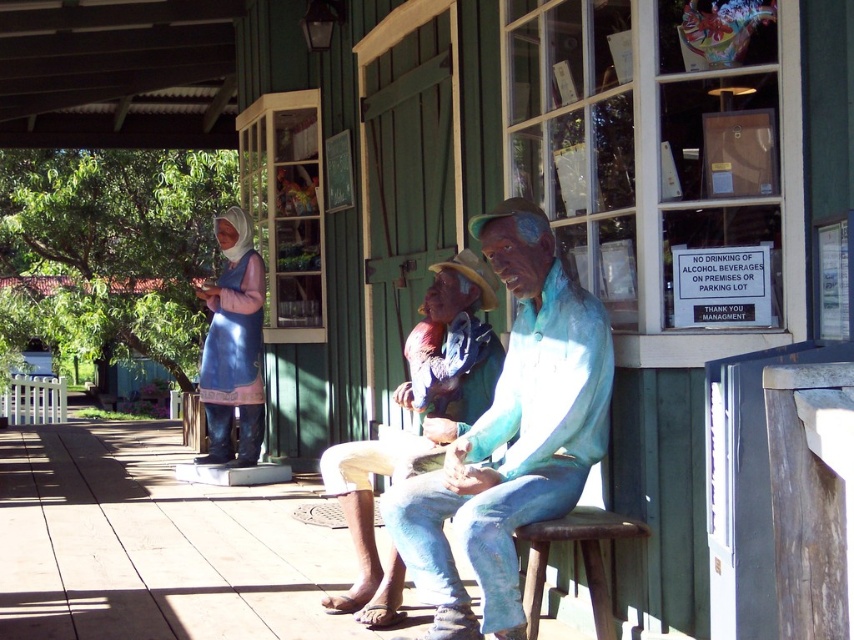
Is matte green statue at center shorter than rustic wood stool at lower right?

No.

Does matte green statue at center appear on the right side of rustic wood stool at lower right?

Incorrect, matte green statue at center is not on the right side of rustic wood stool at lower right.

Who is more distant from viewer, (442,328) or (605,586)?

The point (442,328) is behind.

I want to click on matte green statue at center, so click(x=423, y=422).

Which of these two, matte blue statue at center or matte green statue at center, stands shorter?

Standing shorter between the two is matte green statue at center.

Is matte blue statue at center in front of matte green statue at center?

Yes.

Describe the element at coordinates (512, 435) in the screenshot. This screenshot has width=854, height=640. I see `matte blue statue at center` at that location.

Find the location of `matte blue statue at center`. matte blue statue at center is located at coordinates (512, 435).

Is matte blue statue at center smaller than rustic wood stool at lower right?

Incorrect, matte blue statue at center is not smaller in size than rustic wood stool at lower right.

Does matte blue statue at center have a greater height compared to rustic wood stool at lower right?

Correct, matte blue statue at center is much taller as rustic wood stool at lower right.

Who is more forward, [559,480] or [536,592]?

Point [559,480] is in front.

Where is `matte blue statue at center`? The height and width of the screenshot is (640, 854). matte blue statue at center is located at coordinates (512, 435).